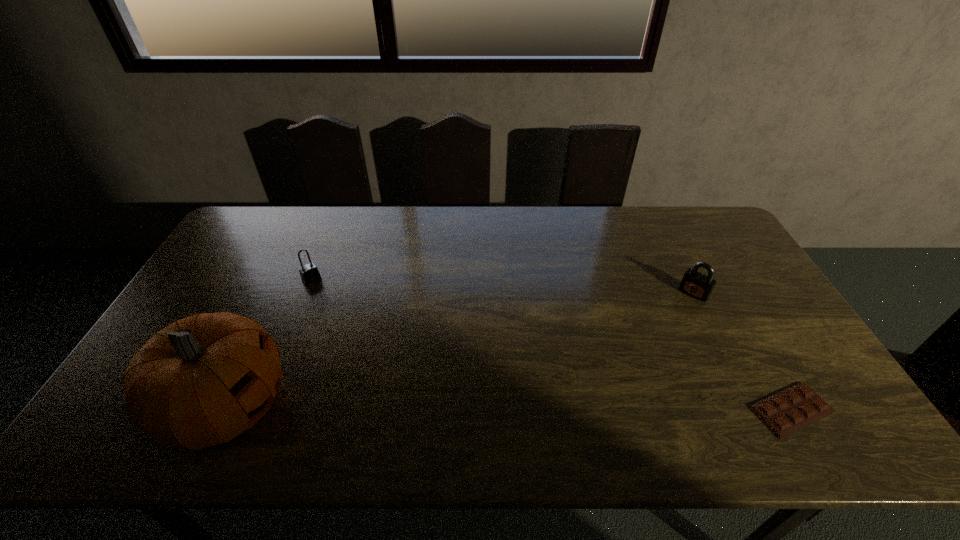
Identify the location of vacant space on the desktop that is between the pumpkin and the shortest object and is positioned on the front of the right padlock near the keyhole. (591, 408).

Where is `vacant space on the desktop that is between the pumpkin and the shortest object and is positioned on the shackle of the left padlock`? This screenshot has height=540, width=960. vacant space on the desktop that is between the pumpkin and the shortest object and is positioned on the shackle of the left padlock is located at coordinates (430, 408).